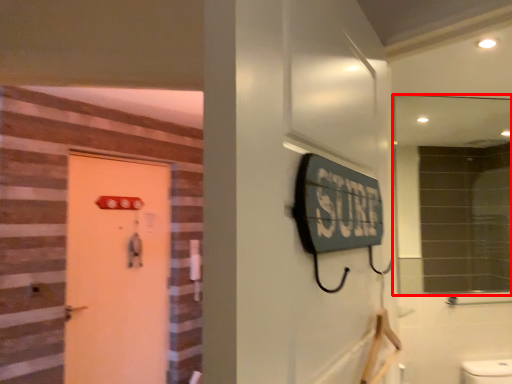
Question: Considering the relative positions of mirror (annotated by the red box) and door in the image provided, where is mirror (annotated by the red box) located with respect to the staircase?

Choices:
 (A) left
 (B) right

Answer: (B)